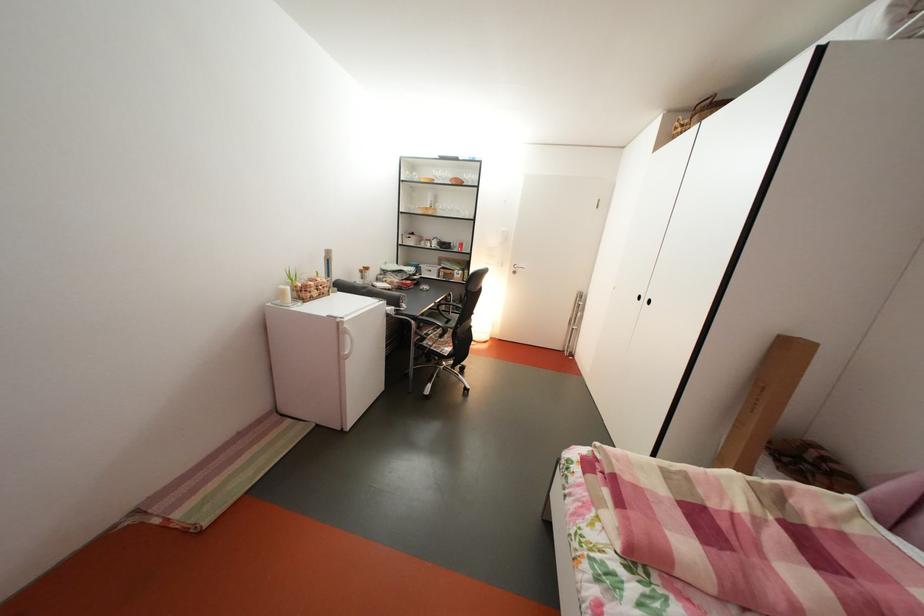
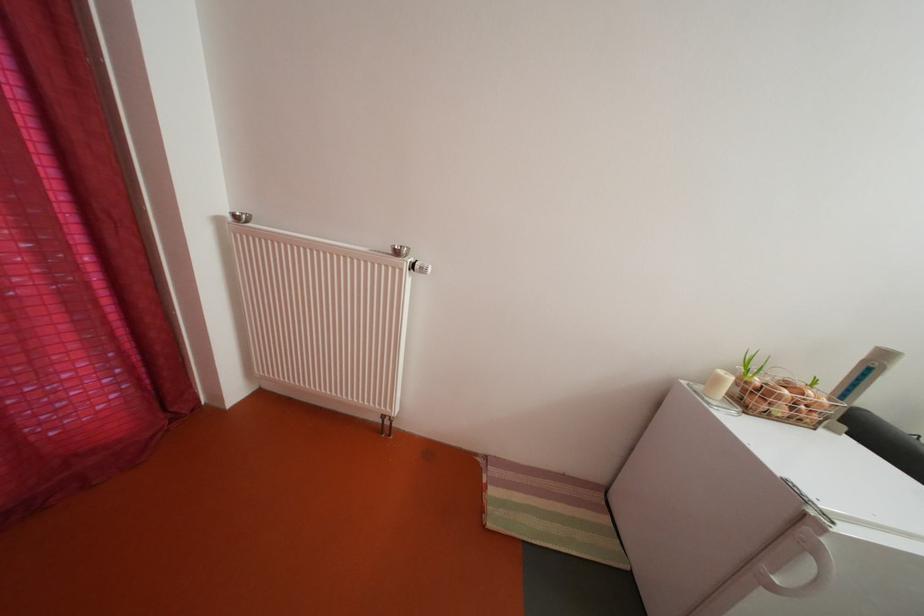
Locate, in the second image, the point that corresponds to (295,298) in the first image.

(728, 386)